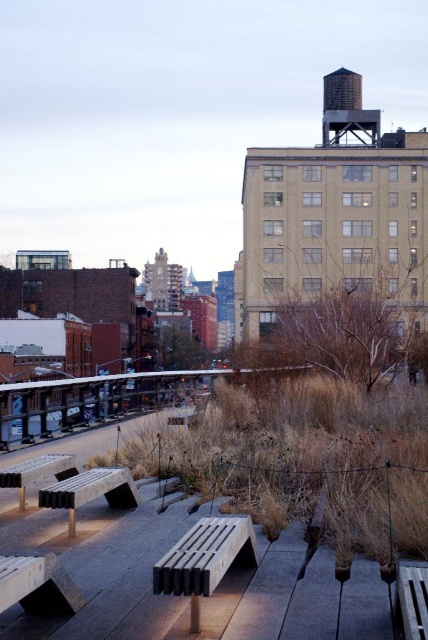
Between point (207, 544) and point (20, 556), which one is positioned behind?

The point (207, 544) is more distant.

Does wooden slats bench at center appear on the right side of wooden bench at lower left?

Yes, wooden slats bench at center is to the right of wooden bench at lower left.

Which is in front, point (238, 563) or point (44, 572)?

Point (44, 572)

This screenshot has width=428, height=640. I want to click on wooden slats bench at center, so click(205, 560).

Is wooden slats bench at center wider than wooden park bench at lower right?

Correct, the width of wooden slats bench at center exceeds that of wooden park bench at lower right.

Who is more distant from viewer, (217, 564) or (410, 563)?

Positioned behind is point (410, 563).

Locate an element on the screen. The image size is (428, 640). wooden slats bench at center is located at coordinates (205, 560).

In the scene shown: Can you confirm if wooden park bench at lower right is smaller than matte white picnic table at lower left?

Correct, wooden park bench at lower right occupies less space than matte white picnic table at lower left.

Measure the distance between wooden park bench at lower right and matte white picnic table at lower left.

A distance of 4.34 meters exists between wooden park bench at lower right and matte white picnic table at lower left.

Does point (404, 568) come closer to viewer compared to point (24, 464)?

That is True.

Find the location of `wooden park bench at lower right`. wooden park bench at lower right is located at coordinates (413, 598).